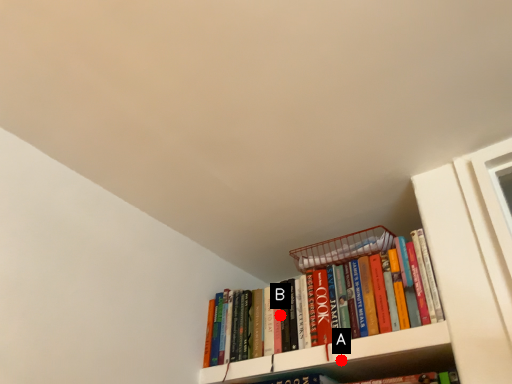
Question: Two points are circled on the image, labeled by A and B beside each circle. Which point appears farthest from the camera in this image?

Choices:
 (A) A is further
 (B) B is further

Answer: (B)